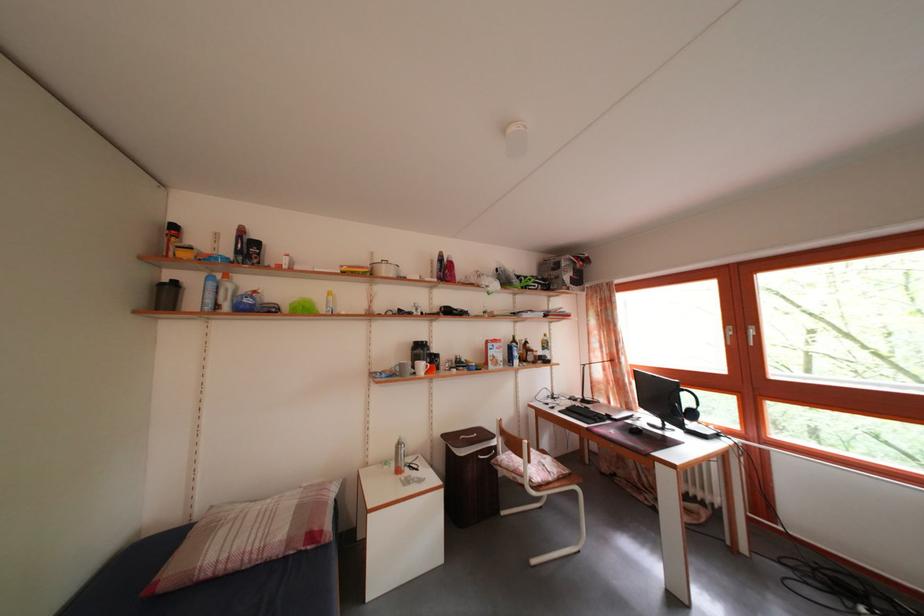
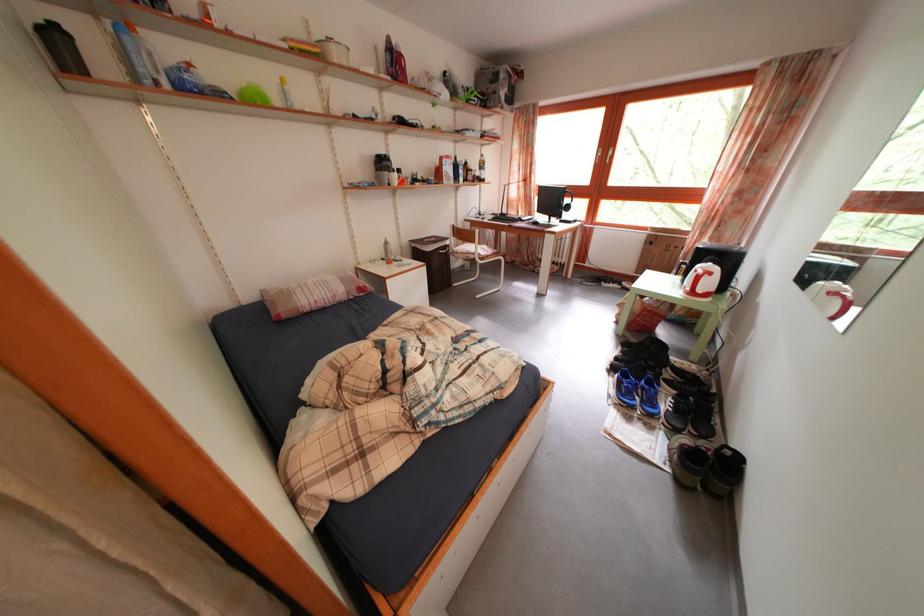
First-person continuous shooting, in which direction is the camera rotating?

The camera rotated toward right-down.